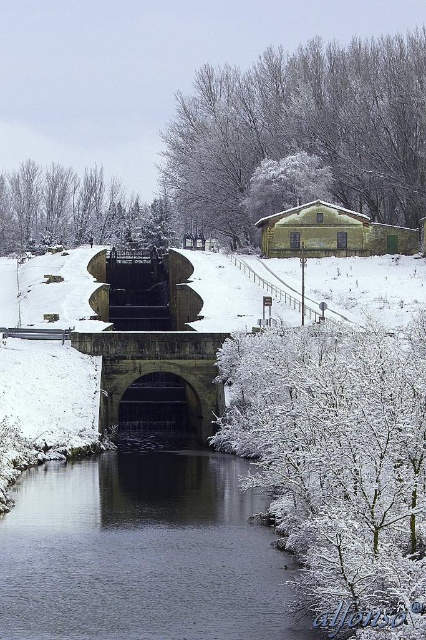
Question: Which point is closer to the camera?

Choices:
 (A) (11, 211)
 (B) (249, 420)
 (C) (115, 372)

Answer: (B)

Question: Among these objects, which one is nearest to the camera?

Choices:
 (A) white frosty branches at lower right
 (B) dark gray water at center
 (C) white frosty tree at upper center
 (D) white snow-covered tree at upper left

Answer: (A)

Question: Considering the relative positions of white frosty branches at lower right and white frosty tree at upper center in the image provided, where is white frosty branches at lower right located with respect to white frosty tree at upper center?

Choices:
 (A) above
 (B) below

Answer: (B)

Question: Does white frosty tree at upper center appear on the right side of stone arch bridge at center?

Choices:
 (A) no
 (B) yes

Answer: (B)

Question: Where is dark gray water at center located in relation to white snow-covered tree at upper left in the image?

Choices:
 (A) above
 (B) below

Answer: (B)

Question: Which of the following is the farthest from the observer?

Choices:
 (A) (296, 120)
 (B) (178, 342)
 (C) (141, 540)
 (D) (94, 188)

Answer: (D)